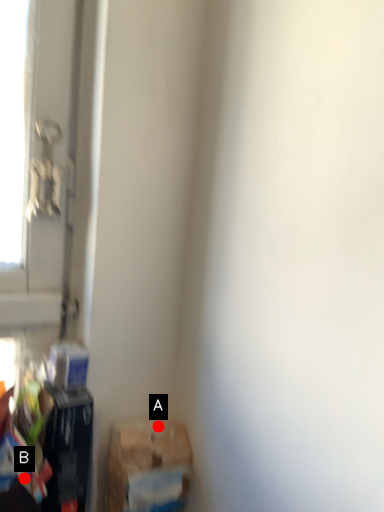
Question: Two points are circled on the image, labeled by A and B beside each circle. Among these points, which one is farthest from the camera?

Choices:
 (A) A is further
 (B) B is further

Answer: (A)